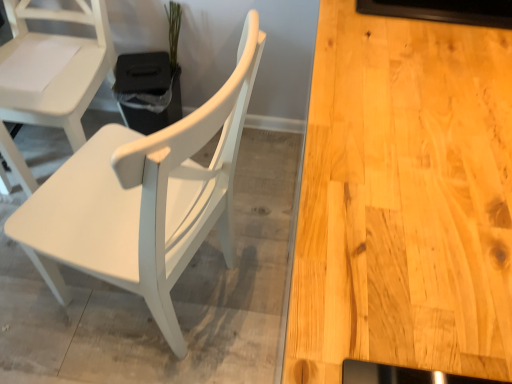
Question: Is point (17, 66) closer or farther from the camera than point (174, 41)?

Choices:
 (A) closer
 (B) farther

Answer: (A)

Question: From the image's perspective, is white matte chair at left, the 1th chair in the left-to-right sequence, located above or below green matte plant at upper center?

Choices:
 (A) above
 (B) below

Answer: (B)

Question: Estimate the real-world distances between objects in this image. Which object is farther from the white matte chair at left, the 1th chair in the left-to-right sequence?

Choices:
 (A) green matte plant at upper center
 (B) white matte wood chair at left, positioned as the first chair in right-to-left order

Answer: (B)

Question: Which of these objects is positioned farthest from the white matte wood chair at left, positioned as the first chair in right-to-left order?

Choices:
 (A) white matte chair at left, the 1th chair in the left-to-right sequence
 (B) green matte plant at upper center

Answer: (B)